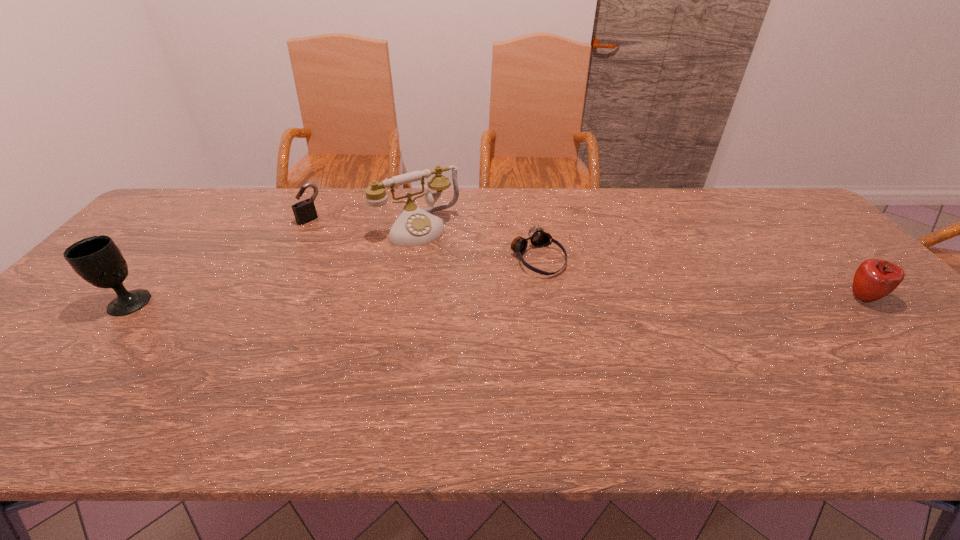
At what (x,y) coordinates should I click in order to perform the action: click on the leftmost object. Please return your answer as a coordinate pair (x, y). Looking at the image, I should click on (97, 259).

Where is `the rightmost object`? The image size is (960, 540). the rightmost object is located at coordinates (874, 279).

This screenshot has width=960, height=540. Identify the location of telephone. (414, 226).

Where is `the fourth object from left to right`? the fourth object from left to right is located at coordinates (538, 238).

The height and width of the screenshot is (540, 960). I want to click on the shortest object, so click(538, 238).

Find the location of a particular element. the fourth object from right to left is located at coordinates (304, 211).

What are the coordinates of `free region located 0.050m on the front of the leftmost object` in the screenshot? It's located at (103, 332).

This screenshot has width=960, height=540. I want to click on free space located 0.060m on the front of the rightmost object, so click(x=891, y=328).

Locate an element on the screen. This screenshot has width=960, height=540. free space located on the dial of the telephone is located at coordinates (456, 272).

The image size is (960, 540). In order to click on vacant space positioned 0.360m on the dial of the telephone in this screenshot , I will do `click(496, 322)`.